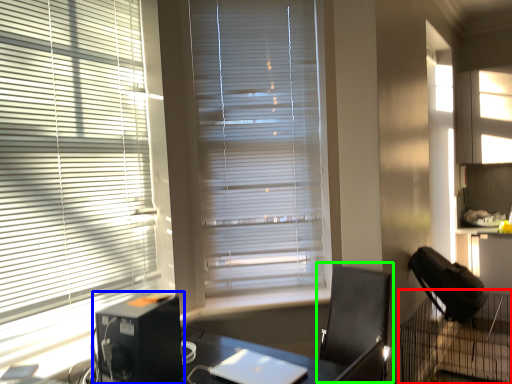
Question: Which object is positioned farthest from computer desk (highlighted by a red box)? Select from computer tower (highlighted by a blue box) and computer chair (highlighted by a green box).

Choices:
 (A) computer tower
 (B) computer chair

Answer: (A)